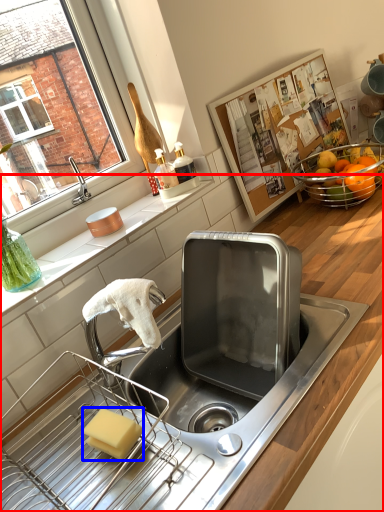
Question: Which point is closer to the camera, countertop (highlighted by a red box) or soap (highlighted by a blue box)?

Choices:
 (A) countertop
 (B) soap

Answer: (A)